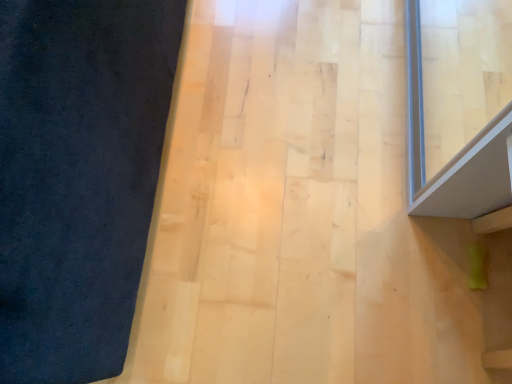
Question: Should I look upward or downward to see dark matte fabric at left?

Choices:
 (A) down
 (B) up

Answer: (B)